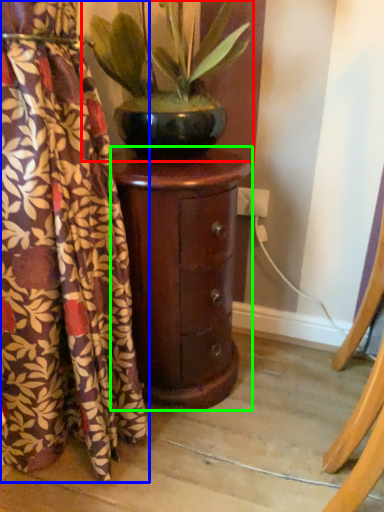
Question: Based on their relative distances, which object is nearer to houseplant (highlighted by a red box)? Choose from curtain (highlighted by a blue box) and furniture (highlighted by a green box).

Choices:
 (A) curtain
 (B) furniture

Answer: (B)